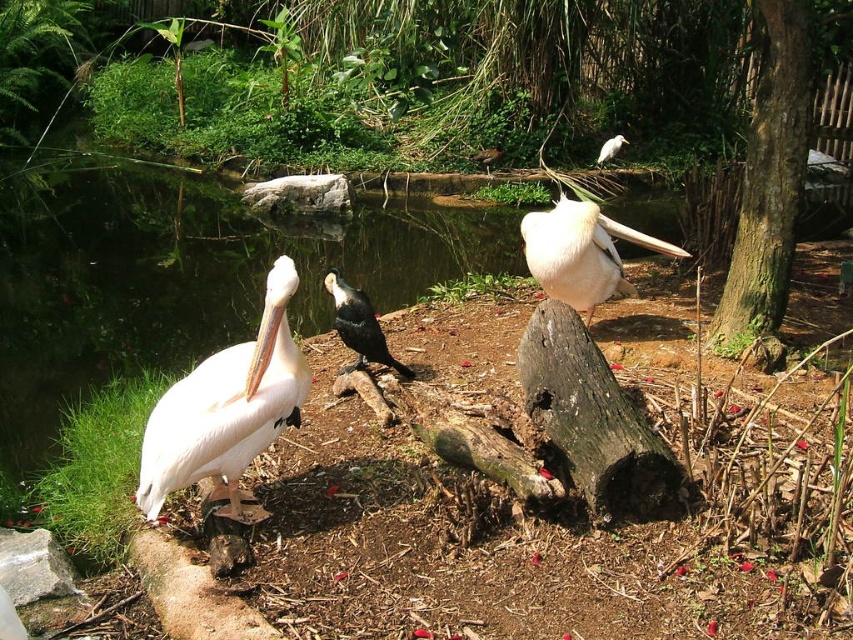
You are a photographer trying to capture a clear photo of the shiny black bird at center without the white matte pelican at left blocking it. Based on their positions, is this possible?

The white matte pelican at left is in front of the shiny black bird at center, so it would block the view of the shiny black bird at center. To capture a clear photo, you would need to adjust your angle or position to avoid the pelican.

You are standing in the outdoor setting and want to take a photo of the white matte pelican at center. If your camera can focus on objects up to 5 meters away, will you be able to capture the pelican clearly?

The white matte pelican at center is 4.65 meters from viewer, which is within the camera focus range of up to 5 meters. Yes, you can capture the pelican clearly.